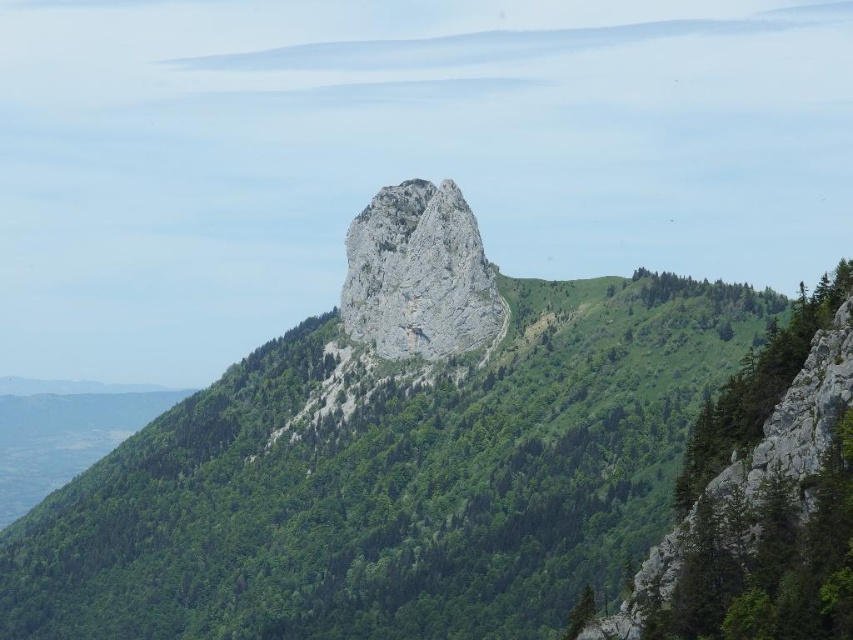
Question: Which point appears closest to the camera in this image?

Choices:
 (A) (635, 444)
 (B) (374, 266)

Answer: (A)

Question: Is green leafy tree at center wider than gray rocky peak at center?

Choices:
 (A) no
 (B) yes

Answer: (B)

Question: Does green leafy tree at center appear over gray rocky peak at center?

Choices:
 (A) no
 (B) yes

Answer: (A)

Question: Among these points, which one is nearest to the camera?

Choices:
 (A) (408, 227)
 (B) (502, 289)

Answer: (B)

Question: Can you confirm if green leafy tree at center is bigger than gray rocky peak at center?

Choices:
 (A) yes
 (B) no

Answer: (A)